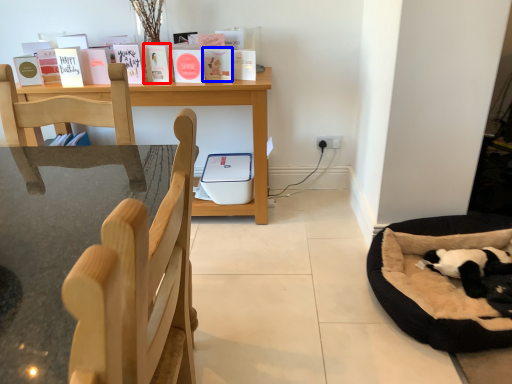
Question: Which of the following is the closest to the observer, paperback book (highlighted by a red box) or paperback book (highlighted by a blue box)?

Choices:
 (A) paperback book
 (B) paperback book

Answer: (A)